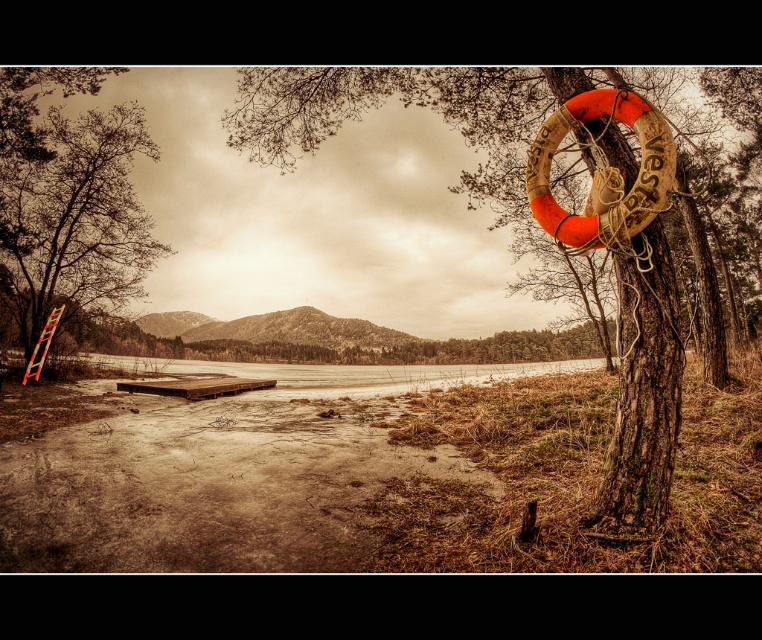
You are standing at the center of the scene and want to walk towards the wooden textured tree trunk at right and the brown rough ladder at left. Which object will you reach first?

The brown rough ladder at left is on the left side of the wooden textured tree trunk at right, so you will reach the brown rough ladder at left first since it is closer to your starting position at the center.

You are standing at point (x=43, y=262) and want to move to point (x=655, y=371). Given the terrain described in the scene, is the path between these two points likely to be obstructed by the wooden dock or the tree trunk?

Point (x=655, y=371) is in front of point (x=43, y=262), so the path between them is unobstructed by the wooden dock or the tree trunk.

You are a painter standing at the wooden textured tree trunk at right and want to reach the brown rough ladder at left to paint it. Can you walk directly to the ladder without needing to move any objects?

The wooden textured tree trunk at right and brown rough ladder at left are 10.16 meters apart from each other, so yes, you can walk directly to the ladder without needing to move any objects as there is enough space between them.